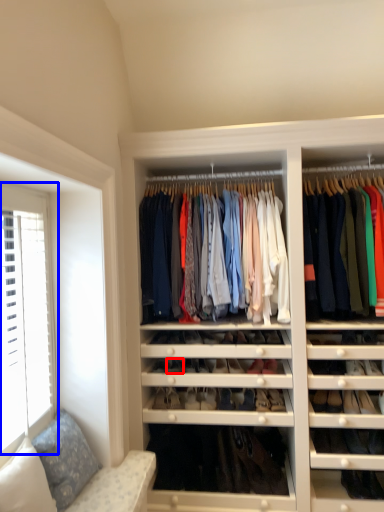
Question: Which point is further to the camera, shoe (highlighted by a red box) or window (highlighted by a blue box)?

Choices:
 (A) shoe
 (B) window

Answer: (A)